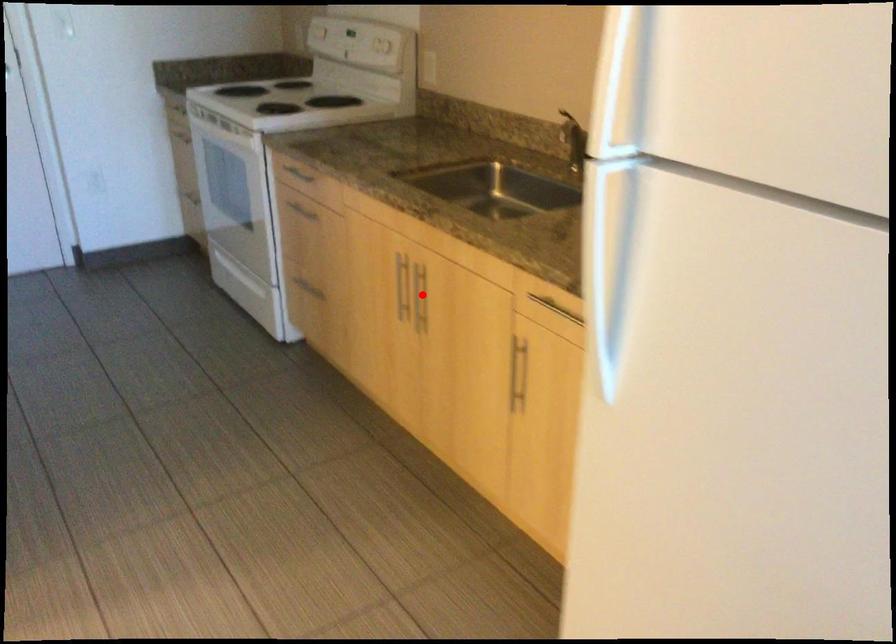
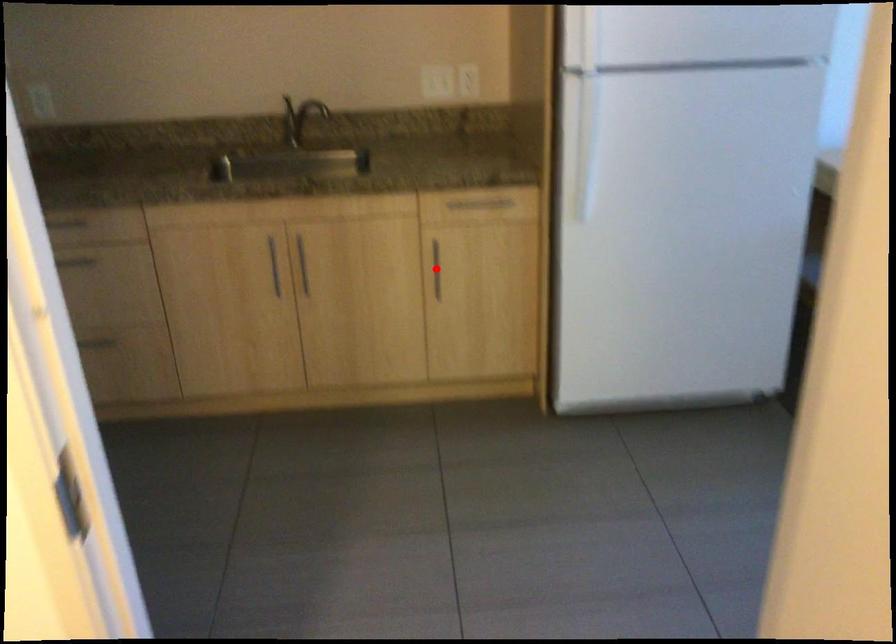
I am providing you with two images of the same scene from different viewpoints. A red point is marked on the first image and another point is marked on the second image. Are the points marked in image1 and image2 representing the same 3D position?

No